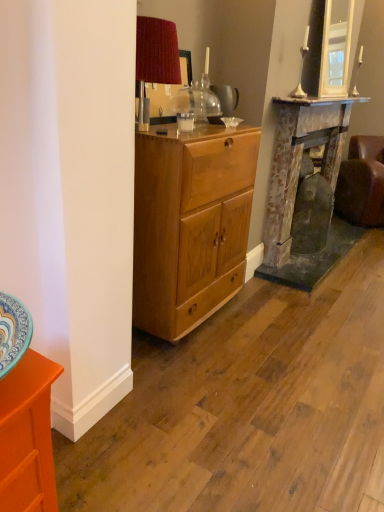
Question: From the image's perspective, is orange glossy cabinet at lower left above clear glass coffee cup at center?

Choices:
 (A) no
 (B) yes

Answer: (A)

Question: Can you confirm if orange glossy cabinet at lower left is bigger than clear glass coffee cup at center?

Choices:
 (A) yes
 (B) no

Answer: (A)

Question: Are orange glossy cabinet at lower left and clear glass coffee cup at center beside each other?

Choices:
 (A) yes
 (B) no

Answer: (B)

Question: Does orange glossy cabinet at lower left appear on the right side of clear glass coffee cup at center?

Choices:
 (A) yes
 (B) no

Answer: (B)

Question: From a real-world perspective, is orange glossy cabinet at lower left located higher than clear glass coffee cup at center?

Choices:
 (A) no
 (B) yes

Answer: (A)

Question: Considering the positions of brown leather couch at right and light brown wood cabinet at center in the image, is brown leather couch at right taller or shorter than light brown wood cabinet at center?

Choices:
 (A) short
 (B) tall

Answer: (A)

Question: From the image's perspective, is brown leather couch at right above or below light brown wood cabinet at center?

Choices:
 (A) above
 (B) below

Answer: (A)

Question: Considering the positions of brown leather couch at right and light brown wood cabinet at center in the image, is brown leather couch at right bigger or smaller than light brown wood cabinet at center?

Choices:
 (A) big
 (B) small

Answer: (A)

Question: In terms of width, does brown leather couch at right look wider or thinner when compared to light brown wood cabinet at center?

Choices:
 (A) wide
 (B) thin

Answer: (A)

Question: In terms of height, does orange glossy cabinet at lower left look taller or shorter compared to translucent glass teapot at center?

Choices:
 (A) short
 (B) tall

Answer: (B)

Question: Is orange glossy cabinet at lower left situated inside translucent glass teapot at center or outside?

Choices:
 (A) inside
 (B) outside

Answer: (B)

Question: Is orange glossy cabinet at lower left bigger or smaller than translucent glass teapot at center?

Choices:
 (A) small
 (B) big

Answer: (B)

Question: Is orange glossy cabinet at lower left wider or thinner than translucent glass teapot at center?

Choices:
 (A) thin
 (B) wide

Answer: (B)

Question: From a real-world perspective, is rusty metal fireplace at right positioned above or below silver metallic candle holder at upper right?

Choices:
 (A) below
 (B) above

Answer: (A)

Question: Looking at the image, does rusty metal fireplace at right seem bigger or smaller compared to silver metallic candle holder at upper right?

Choices:
 (A) small
 (B) big

Answer: (B)